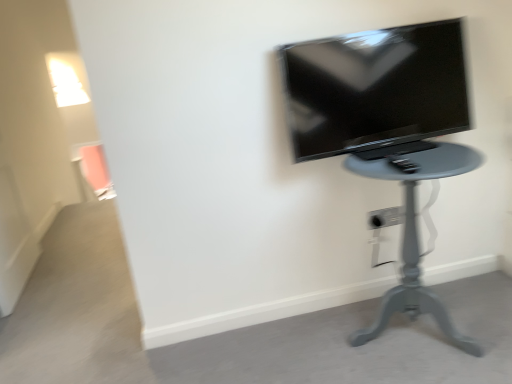
The width and height of the screenshot is (512, 384). Find the location of `vacant area on top of matte gray table at center (from a real-world perspective)`. vacant area on top of matte gray table at center (from a real-world perspective) is located at coordinates (401, 145).